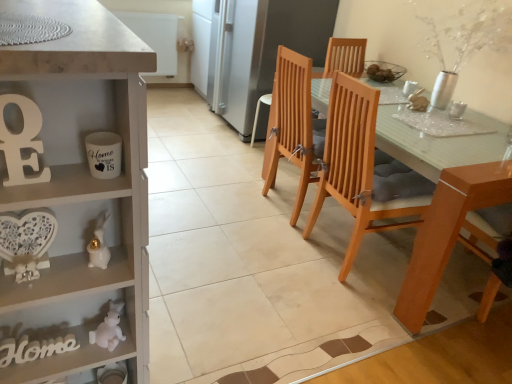
Question: Would you say light brown wood chair at center, which appears as the first chair when viewed from the left, contains satin silver refrigerator at center?

Choices:
 (A) no
 (B) yes

Answer: (A)

Question: Is light brown wood chair at center, which appears as the first chair when viewed from the left, far away from satin silver refrigerator at center?

Choices:
 (A) no
 (B) yes

Answer: (A)

Question: Is light brown wood chair at center, the 3th chair in the right-to-left sequence, aimed at satin silver refrigerator at center?

Choices:
 (A) no
 (B) yes

Answer: (A)

Question: Is light brown wood chair at center, the 3th chair in the right-to-left sequence, looking in the opposite direction of satin silver refrigerator at center?

Choices:
 (A) yes
 (B) no

Answer: (B)

Question: Does light brown wood chair at center, which appears as the first chair when viewed from the left, have a lesser width compared to satin silver refrigerator at center?

Choices:
 (A) yes
 (B) no

Answer: (A)

Question: From a real-world perspective, is white painted wood cabinet at left physically located above or below white matte letter e at left?

Choices:
 (A) above
 (B) below

Answer: (B)

Question: Looking at their shapes, would you say white painted wood cabinet at left is wider or thinner than white matte letter e at left?

Choices:
 (A) thin
 (B) wide

Answer: (B)

Question: Considering the positions of white painted wood cabinet at left and white matte letter e at left in the image, is white painted wood cabinet at left bigger or smaller than white matte letter e at left?

Choices:
 (A) big
 (B) small

Answer: (A)

Question: Considering their positions, is white painted wood cabinet at left located in front of or behind white matte letter e at left?

Choices:
 (A) behind
 (B) front

Answer: (B)

Question: Would you say white matte letter e at left is to the left or to the right of white painted wood cabinet at left in the picture?

Choices:
 (A) right
 (B) left

Answer: (A)

Question: Relative to white painted wood cabinet at left, is white matte letter e at left in front or behind?

Choices:
 (A) front
 (B) behind

Answer: (B)

Question: In terms of width, does white matte letter e at left look wider or thinner when compared to white painted wood cabinet at left?

Choices:
 (A) wide
 (B) thin

Answer: (B)

Question: From a real-world perspective, is white matte letter e at left positioned above or below white painted wood cabinet at left?

Choices:
 (A) below
 (B) above

Answer: (B)

Question: Do you think white matte rabbit at lower left, marked as the 1th toy in a bottom-to-top arrangement, is within satin silver refrigerator at center, or outside of it?

Choices:
 (A) inside
 (B) outside

Answer: (B)

Question: Considering the positions of point (115, 316) and point (244, 77), is point (115, 316) closer or farther from the camera than point (244, 77)?

Choices:
 (A) farther
 (B) closer

Answer: (B)